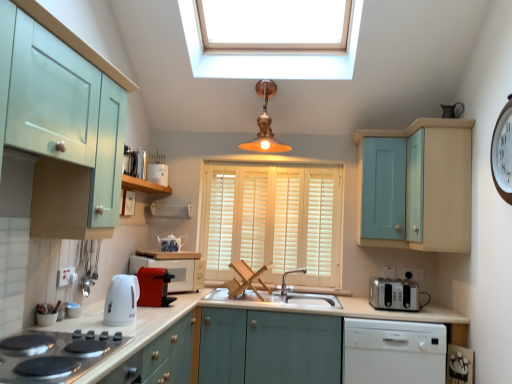
What do you see at coordinates (121, 300) in the screenshot?
I see `white glossy electric kettle at lower left` at bounding box center [121, 300].

Describe the element at coordinates (129, 162) in the screenshot. I see `matte black toaster at upper left, positioned as the first appliance in top-to-bottom order` at that location.

Describe the element at coordinates (269, 347) in the screenshot. I see `matte teal cabinet at center, which is counted as the third cabinetry, starting from the top` at that location.

Locate an element on the screen. The image size is (512, 384). white ceramic toaster at center, which appears as the second appliance when viewed from the left is located at coordinates (158, 173).

What do you see at coordinates (393, 352) in the screenshot?
I see `white plastic dishwasher at lower right` at bounding box center [393, 352].

In order to click on white glossy electric kettle at lower left in this screenshot , I will do `click(121, 300)`.

Between white wood blinds at center and white matte exhaust hood at upper center, which one appears on the left side from the viewer's perspective?

white matte exhaust hood at upper center.

Is white wood blinds at center oriented away from white matte exhaust hood at upper center?

No, white wood blinds at center's orientation is not away from white matte exhaust hood at upper center.

Which is more distant, (312, 241) or (185, 202)?

Point (312, 241)

Is white ceramic toaster at center, which appears as the second appliance when viewed from the left, aimed at black glass cooktop at lower left?

No, white ceramic toaster at center, which appears as the second appliance when viewed from the left, is not aimed at black glass cooktop at lower left.

Which is in front, point (160, 184) or point (90, 343)?

The point (90, 343) is closer to the camera.

The width and height of the screenshot is (512, 384). Identify the location of gas stove on the left of white ceramic toaster at center, acting as the second appliance starting from the top. (51, 356).

Which object is further away from the camera taking this photo, matte teal cabinet at center, positioned as the 1th cabinetry in bottom-to-top order, or satin silver toaster at right, arranged as the fourth appliance when viewed from the top?

satin silver toaster at right, arranged as the fourth appliance when viewed from the top.

Which is nearer, [214,373] or [414,305]?

Clearly, point [214,373] is closer to the camera than point [414,305].

The height and width of the screenshot is (384, 512). Identify the location of kitchen appliance that is in front of the light blue wood cabinet at upper right, marked as the 3th cabinetry in a left-to-right arrangement. (121, 300).

Is white glossy electric kettle at lower left shorter than light blue wood cabinet at upper right, the second cabinetry from the top?

Indeed, white glossy electric kettle at lower left has a lesser height compared to light blue wood cabinet at upper right, the second cabinetry from the top.

What's the angular difference between white glossy electric kettle at lower left and light blue wood cabinet at upper right, the second cabinetry from the top,'s facing directions?

The angular difference between white glossy electric kettle at lower left and light blue wood cabinet at upper right, the second cabinetry from the top, is 173 degrees.

Based on the photo, can you confirm if white glossy electric kettle at lower left is positioned to the right of light blue wood cabinet at upper right, marked as the 3th cabinetry in a left-to-right arrangement?

No.

Do you think matte teal cabinet at center, the 2th cabinetry in the right-to-left sequence, is within copper/brass pendant light at center, or outside of it?

matte teal cabinet at center, the 2th cabinetry in the right-to-left sequence, cannot be found inside copper/brass pendant light at center.

Does matte teal cabinet at center, placed as the 2th cabinetry when sorted from left to right, lie behind copper/brass pendant light at center?

No.

How many degrees apart are the facing directions of matte teal cabinet at center, placed as the 2th cabinetry when sorted from left to right, and copper/brass pendant light at center?

The angular difference between matte teal cabinet at center, placed as the 2th cabinetry when sorted from left to right, and copper/brass pendant light at center is 0.892 degrees.

From a real-world perspective, which object rests below the other?

In real-world perspective, matte teal cabinet at center, positioned as the 1th cabinetry in bottom-to-top order, is lower.

How many degrees apart are the facing directions of copper/brass pendant light at center and white ceramic toaster at center, acting as the second appliance starting from the top?

The angle between the facing direction of copper/brass pendant light at center and the facing direction of white ceramic toaster at center, acting as the second appliance starting from the top, is 97.4 degrees.

From the picture: Which of these two, copper/brass pendant light at center or white ceramic toaster at center, the third appliance viewed from the right, is thinner?

Thinner between the two is white ceramic toaster at center, the third appliance viewed from the right.

From the image's perspective, which one is positioned higher, copper/brass pendant light at center or white ceramic toaster at center, acting as the second appliance starting from the top?

From the image's view, copper/brass pendant light at center is above.

Is the depth of copper/brass pendant light at center greater than that of matte black toaster at upper left, positioned as the first appliance in top-to-bottom order?

Yes, copper/brass pendant light at center is behind matte black toaster at upper left, positioned as the first appliance in top-to-bottom order.

From the picture: Considering the sizes of copper/brass pendant light at center and matte black toaster at upper left, positioned as the first appliance in top-to-bottom order, in the image, is copper/brass pendant light at center wider or thinner than matte black toaster at upper left, positioned as the first appliance in top-to-bottom order,?

copper/brass pendant light at center is wider than matte black toaster at upper left, positioned as the first appliance in top-to-bottom order.

Can you confirm if copper/brass pendant light at center is bigger than matte black toaster at upper left, positioned as the first appliance in top-to-bottom order?

Yes, copper/brass pendant light at center is bigger than matte black toaster at upper left, positioned as the first appliance in top-to-bottom order.

This screenshot has width=512, height=384. Find the location of `window that appears behind the white matte exhaust hood at upper center`. window that appears behind the white matte exhaust hood at upper center is located at coordinates (274, 221).

The height and width of the screenshot is (384, 512). I want to click on gas stove that appears in front of the white ceramic toaster at center, which appears as the second appliance when viewed from the left, so click(51, 356).

Based on their spatial positions, is black glass cooktop at lower left or satin silver toaster at right, which ranks as the first appliance in bottom-to-top order, closer to white glossy electric kettle at lower left?

black glass cooktop at lower left is closer to white glossy electric kettle at lower left.

Looking at this image, which object lies nearer to the anchor point matte black toaster at upper left, which is the first appliance from left to right, white ceramic toaster at center, acting as the second appliance starting from the top, or white matte exhaust hood at upper center?

white ceramic toaster at center, acting as the second appliance starting from the top, lies closer to matte black toaster at upper left, which is the first appliance from left to right, than the other object.

Considering their positions, is matte light blue cabinet at left, the first cabinetry in the left-to-right sequence, positioned closer to red plastic coffee machine at center than white ceramic toaster at center, the third appliance viewed from the right?

white ceramic toaster at center, the third appliance viewed from the right, is closer to red plastic coffee machine at center.

In the scene shown: When comparing their distances from white matte exhaust hood at upper center, does white wood blinds at center or matte red microwave at center, the 3th appliance in the top-to-bottom sequence, seem further?

white wood blinds at center lies further to white matte exhaust hood at upper center than the other object.

Which object lies nearer to the anchor point satin silver toaster at right, which is the 4th appliance from left to right, black glass cooktop at lower left or white plastic dishwasher at lower right?

white plastic dishwasher at lower right is positioned closer to the anchor satin silver toaster at right, which is the 4th appliance from left to right.

Estimate the real-world distances between objects in this image. Which object is further from white wood blinds at center, white matte exhaust hood at upper center or satin silver toaster at right, which ranks as the first appliance in bottom-to-top order?

satin silver toaster at right, which ranks as the first appliance in bottom-to-top order, is positioned further to the anchor white wood blinds at center.

Consider the image. Which object lies nearer to the anchor point red plastic coffee machine at center, matte teal cabinet at center, placed as the 2th cabinetry when sorted from left to right, or white wood blinds at center?

Based on the image, matte teal cabinet at center, placed as the 2th cabinetry when sorted from left to right, appears to be nearer to red plastic coffee machine at center.

Estimate the real-world distances between objects in this image. Which object is closer to teal wooden cabinet at upper right, wooden shelf at upper left or white wood blinds at center?

white wood blinds at center.

Identify the location of gas stove positioned between matte light blue cabinet at left, the third cabinetry from the bottom, and copper/brass pendant light at center from near to far. (51, 356).

This screenshot has height=384, width=512. Identify the location of home appliance between copper/brass pendant light at center and matte teal cabinet at center, the 2th cabinetry in the right-to-left sequence, vertically. (393, 352).

Find the location of `faucet between white wood blinds at center and matte teal cabinet at center, which is counted as the third cabinetry, starting from the top, from top to bottom`. faucet between white wood blinds at center and matte teal cabinet at center, which is counted as the third cabinetry, starting from the top, from top to bottom is located at coordinates (285, 278).

Find the location of a particular element. The image size is (512, 384). cabinetry between white ceramic toaster at center, the third appliance viewed from the right, and white plastic dishwasher at lower right, in the horizontal direction is located at coordinates (269, 347).